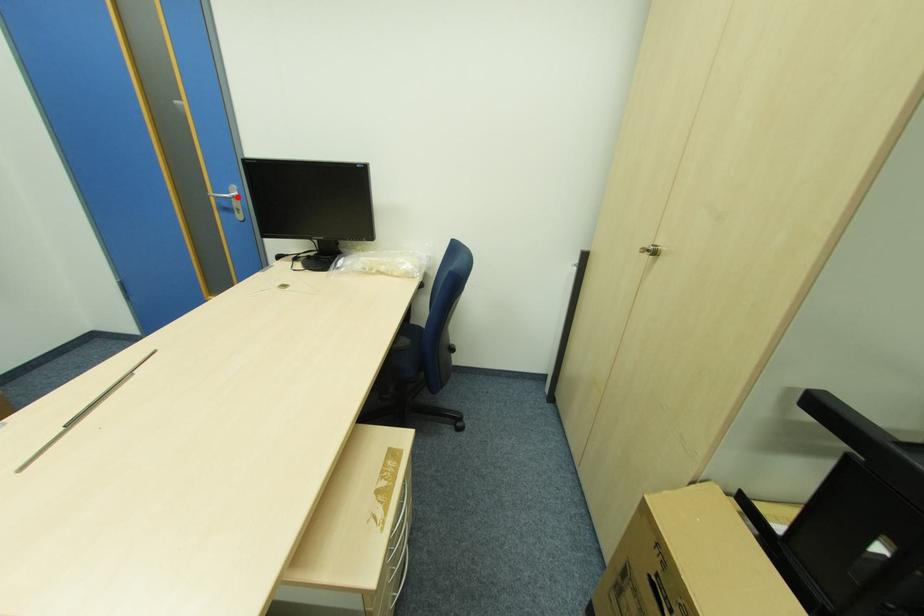
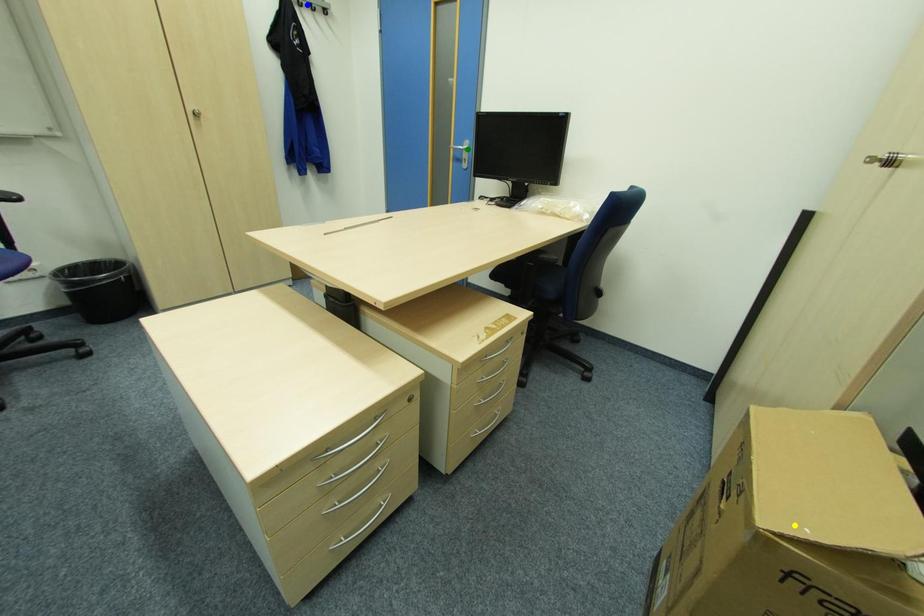
Question: I am providing you with two images of the same scene from different viewpoints. A red point is marked on the first image. You are given multiple points on the second image. Which spot in image 2 lines up with the point in image 1?

Choices:
 (A) yellow point
 (B) green point
 (C) blue point

Answer: (B)